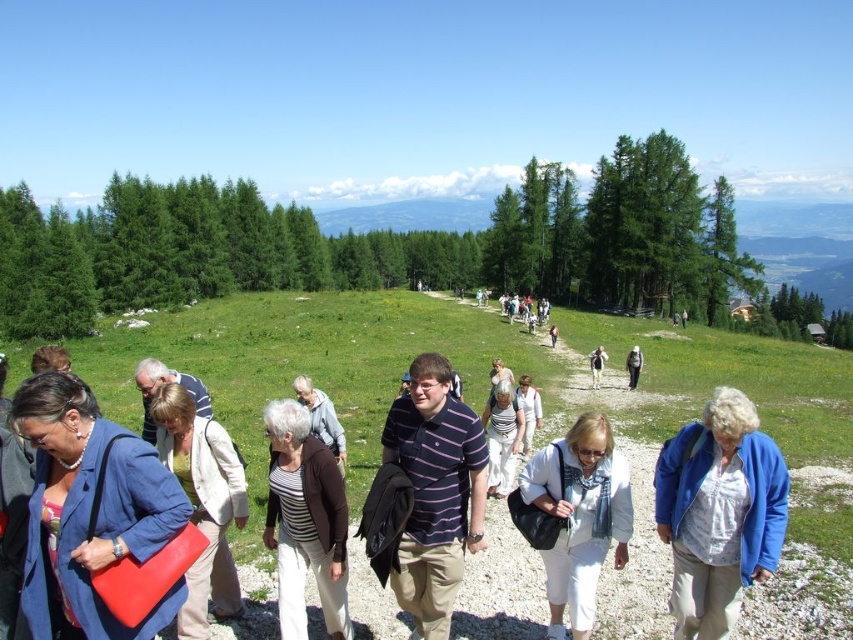
You are a photographer trying to capture a clear shot of the mountain range in the background. You notice two items in the center of the image that might obstruct your view. Which item, the white cotton pants at center or the white fabric bag at center, is wider and thus more likely to block the mountain view?

The white cotton pants at center is wider than the white fabric bag at center, so it is more likely to block the mountain view.

You are a photographer trying to capture a clear shot of the striped knit sweater at center and the white fabric bag at center. Which object is blocking the view of the other?

The striped knit sweater at center is positioned under the white fabric bag at center, so the white fabric bag at center is blocking the view of the striped knit sweater at center.

You are a photographer standing at the center of the gravel path. You want to take a photo of the matte blue blazer at lower left and ensure that the mountain range in the background is also visible. Given the distance between them, will you be able to capture both in a single frame without moving your position?

The matte blue blazer at lower left and the mountain range are 26.04 feet apart. Since the distance is manageable within a standard camera frame, you can capture both in a single shot without moving.